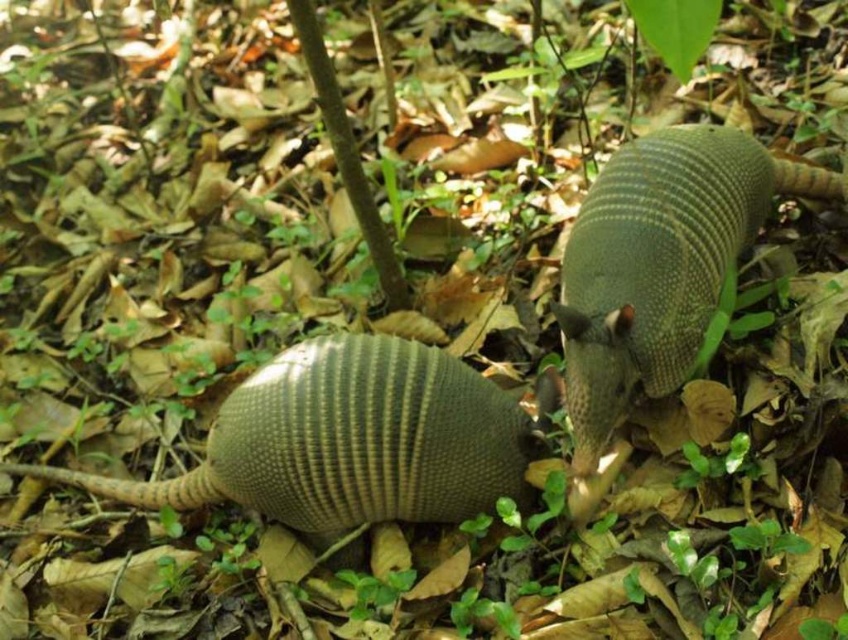
You are an animal researcher observing two armadillos in a forest. You see the brown textured armadillo at lower left and the green textured armadillo at center. Which armadillo is farther away from you?

The green textured armadillo at center is farther away because it is positioned behind the brown textured armadillo at lower left, which is closer to the viewer.

You are an armadillo enthusiast standing 2 meters away from a brown textured armadillo at lower left in a forest. Can you safely approach it to take a closer look without disturbing it?

The brown textured armadillo at lower left is 1.90 meters away from the camera. Since you are already 2 meters away, you can move slightly closer to observe it without causing disturbance, as the distance is within a safe range.